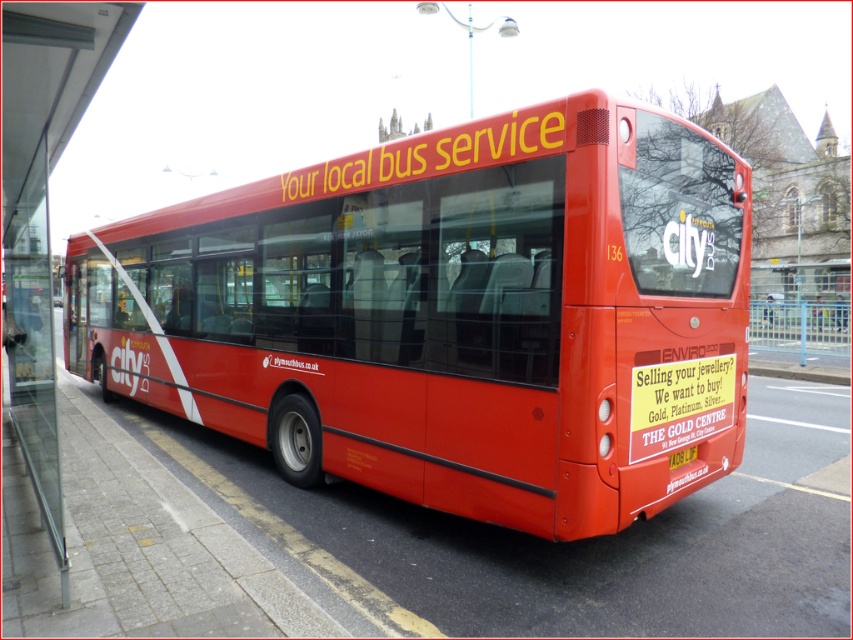
You are a pedestrian standing in front of the glossy red bus at center. You want to read the text on the yellow plastic license plate at center. Can you see it clearly from your current position?

The glossy red bus at center is closer to the viewer than the yellow plastic license plate at center, so the license plate is behind the bus and not visible from your current position.

Consider the image. You are a pedestrian standing at the bus stop looking at the glossy red bus at center and the yellow plastic license plate at center. Which object is positioned to the left?

The glossy red bus at center is positioned to the left of the yellow plastic license plate at center.

You are standing at a bus stop and see the glossy red bus at center. If you want to board the bus, will you have to walk more than 15 feet to reach it?

The glossy red bus at center is 13.47 feet away from viewer, so you will not have to walk more than 15 feet to reach it.